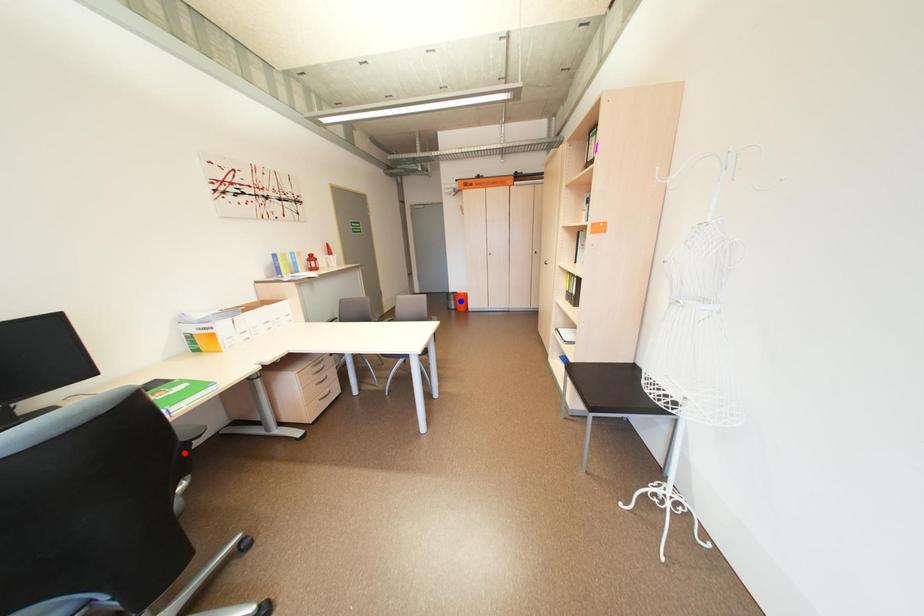
Question: Which of the two points in the image is closer to the camera?

Choices:
 (A) Blue point is closer.
 (B) Red point is closer.

Answer: (B)